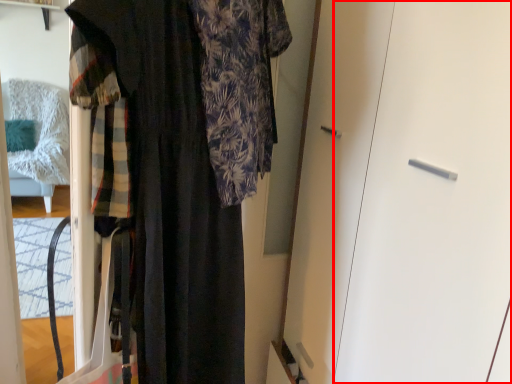
Question: From the image's perspective, where is screen door (annotated by the red box) located relative to fancy dress?

Choices:
 (A) above
 (B) below

Answer: (B)